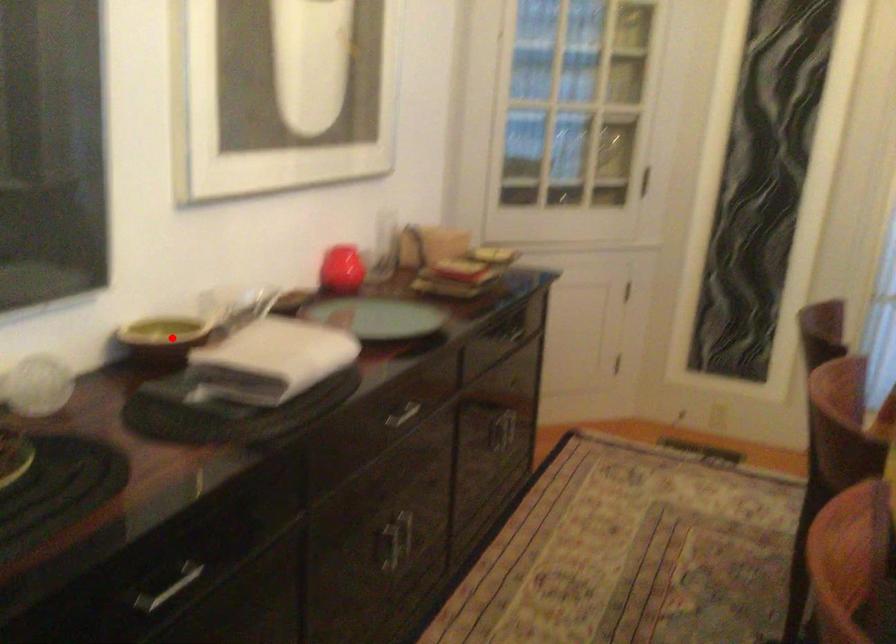
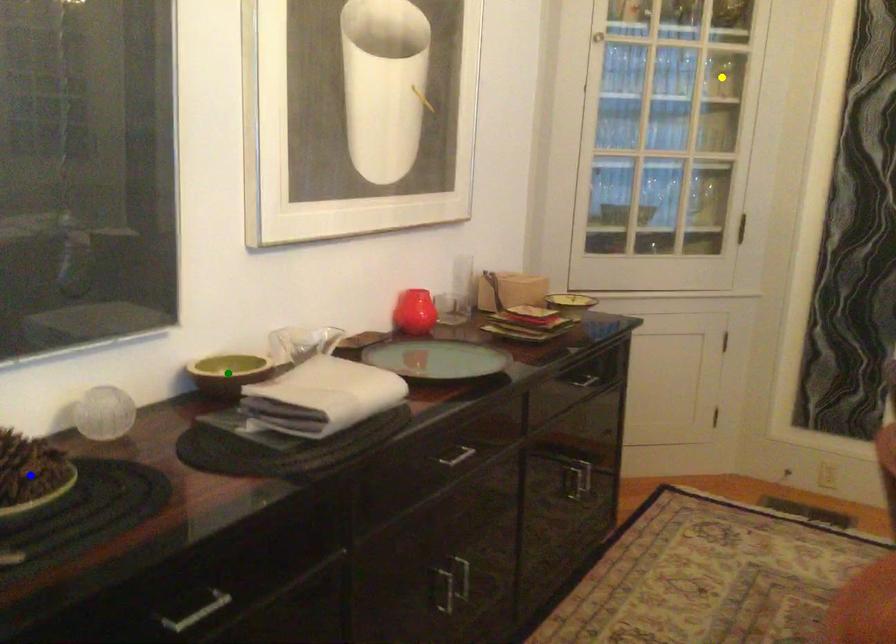
Question: I am providing you with two images of the same scene from different viewpoints. A red point is marked on the first image. You are given multiple points on the second image. In image 2, which mark is for the same physical point as the one in image 1?

Choices:
 (A) blue point
 (B) green point
 (C) yellow point

Answer: (B)